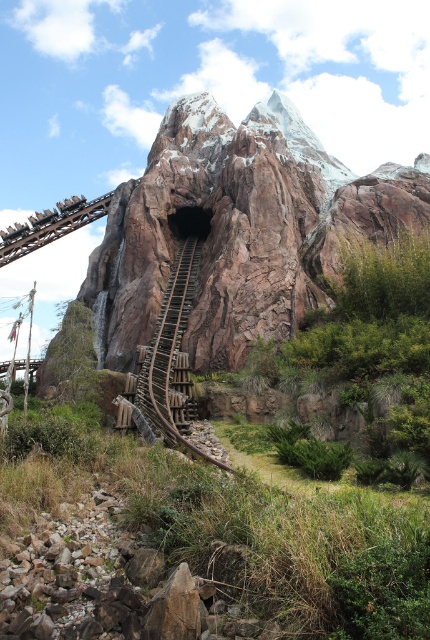
You are a photographer planning to capture the rustic wood mountain at center and the wooden at center in a single shot. Which object should you focus on first to ensure both are in frame?

The rustic wood mountain at center is taller than wooden at center, so you should focus on the rustic wood mountain at center first to ensure both are in frame.